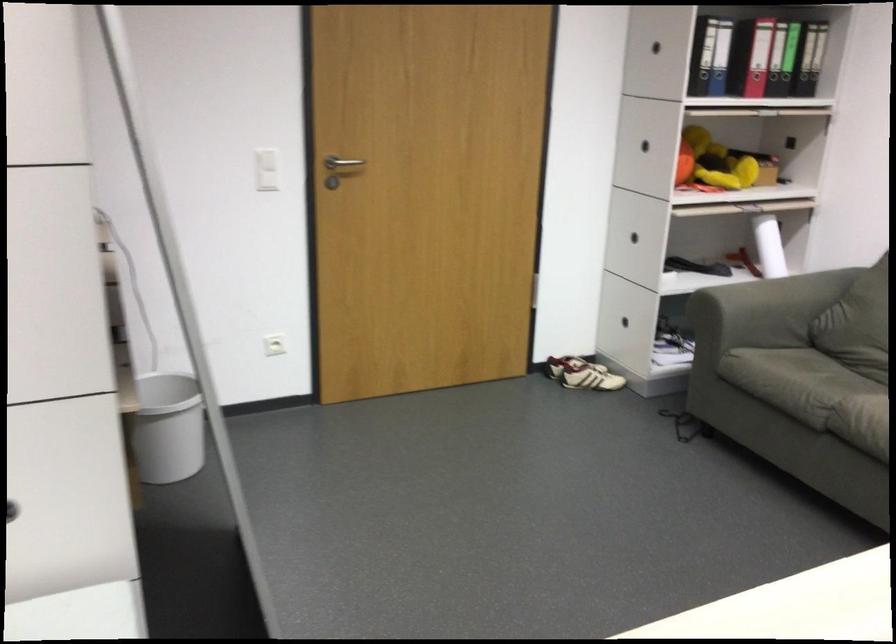
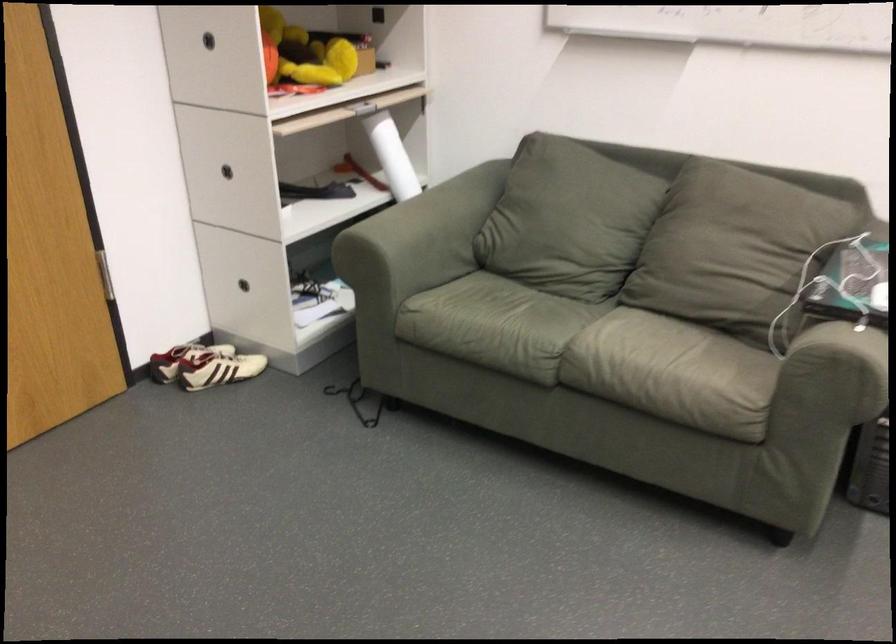
The point at (576, 373) is marked in the first image. Where is the corresponding point in the second image?

(218, 368)